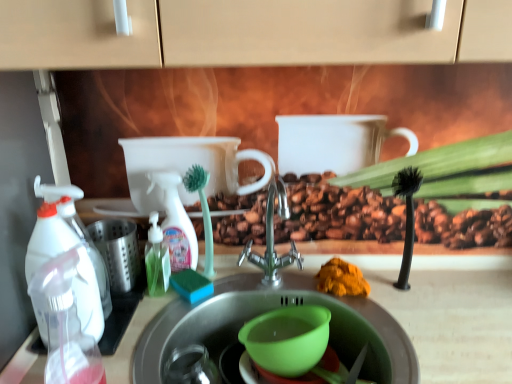
Question: Does transparent plastic spray bottle at left, acting as the 1th cleaning product starting from the front, touch orange powder at sink?

Choices:
 (A) yes
 (B) no

Answer: (B)

Question: Is orange powder at sink at the back of transparent plastic spray bottle at left, placed as the second cleaning product when sorted from back to front?

Choices:
 (A) no
 (B) yes

Answer: (A)

Question: Is transparent plastic spray bottle at left, which is the 2th cleaning product from right to left, behind orange powder at sink?

Choices:
 (A) no
 (B) yes

Answer: (A)

Question: Considering the relative positions of transparent plastic spray bottle at left, acting as the first cleaning product starting from the left, and orange powder at sink in the image provided, is transparent plastic spray bottle at left, acting as the first cleaning product starting from the left, to the right of orange powder at sink from the viewer's perspective?

Choices:
 (A) no
 (B) yes

Answer: (A)

Question: From the image's perspective, does transparent plastic spray bottle at left, placed as the second cleaning product when sorted from back to front, appear higher than orange powder at sink?

Choices:
 (A) no
 (B) yes

Answer: (B)

Question: Can we say transparent plastic spray bottle at left, placed as the second cleaning product when sorted from back to front, lies outside orange powder at sink?

Choices:
 (A) no
 (B) yes

Answer: (B)

Question: Is translucent plastic bottle at center-left, which appears as the 2th bottle when viewed from the left, taller than satin nickel faucet at center?

Choices:
 (A) yes
 (B) no

Answer: (B)

Question: Is translucent plastic bottle at center-left, positioned as the 2th bottle in front-to-back order, bigger than satin nickel faucet at center?

Choices:
 (A) no
 (B) yes

Answer: (A)

Question: From the image's perspective, is translucent plastic bottle at center-left, marked as the 1th bottle in a right-to-left arrangement, located beneath satin nickel faucet at center?

Choices:
 (A) yes
 (B) no

Answer: (A)

Question: Considering the relative sizes of translucent plastic bottle at center-left, the 1th bottle when ordered from back to front, and satin nickel faucet at center in the image provided, is translucent plastic bottle at center-left, the 1th bottle when ordered from back to front, smaller than satin nickel faucet at center?

Choices:
 (A) no
 (B) yes

Answer: (B)

Question: Does translucent plastic bottle at center-left, positioned as the 2th bottle in front-to-back order, lie behind satin nickel faucet at center?

Choices:
 (A) no
 (B) yes

Answer: (B)

Question: Does translucent plastic bottle at center-left, positioned as the 2th bottle in front-to-back order, appear on the right side of satin nickel faucet at center?

Choices:
 (A) no
 (B) yes

Answer: (A)

Question: Are translucent plastic bottle at center-left, positioned as the 2th bottle in front-to-back order, and transparent plastic spray bottle at left, the 2th bottle from the back, located far from each other?

Choices:
 (A) yes
 (B) no

Answer: (B)